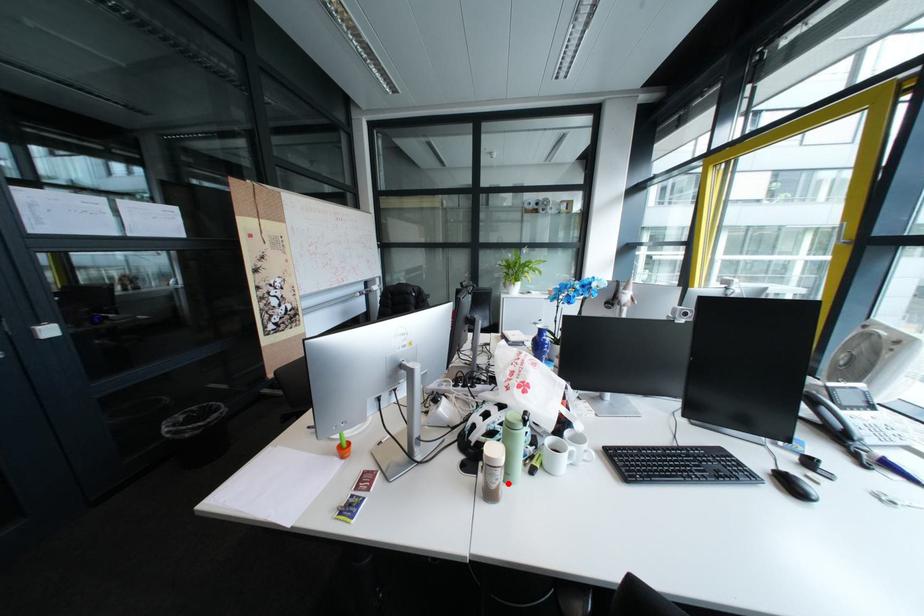
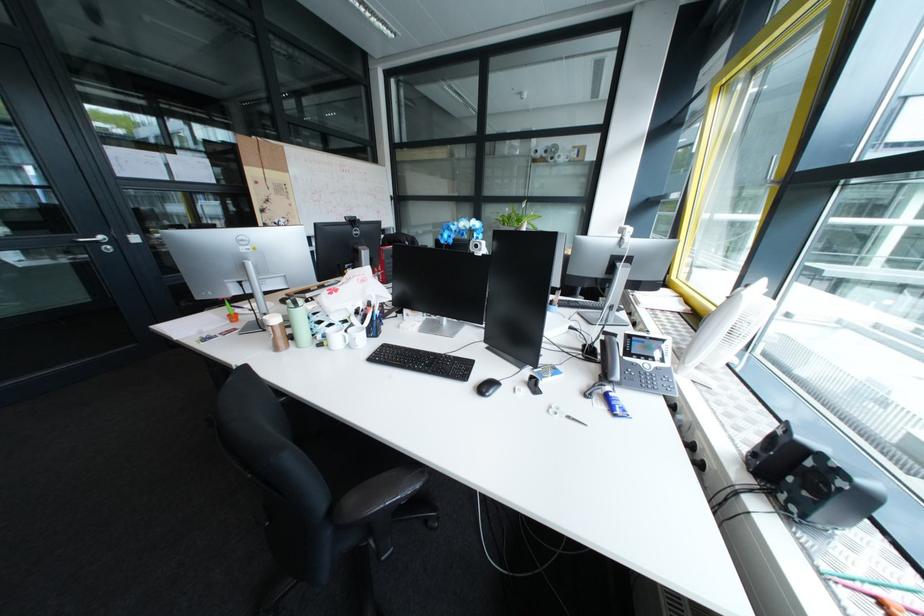
In the second image, find the point that corresponds to the highlighted location in the first image.

(284, 338)